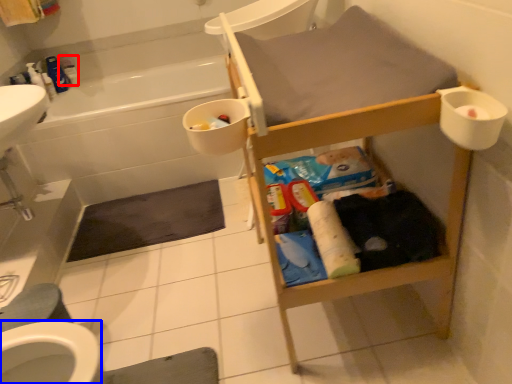
Question: Which object appears closest to the camera in this image, toiletry (highlighted by a red box) or bidet (highlighted by a blue box)?

Choices:
 (A) toiletry
 (B) bidet

Answer: (B)